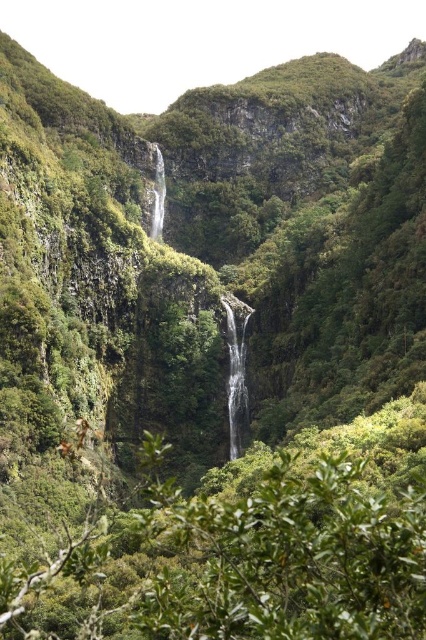
Question: Can you confirm if white smooth waterfall at center is thinner than transparent glass waterfall at center?

Choices:
 (A) no
 (B) yes

Answer: (A)

Question: Among these points, which one is nearest to the camera?

Choices:
 (A) pyautogui.click(x=158, y=237)
 (B) pyautogui.click(x=236, y=346)

Answer: (B)

Question: Can you confirm if white smooth waterfall at center is positioned below transparent glass waterfall at center?

Choices:
 (A) yes
 (B) no

Answer: (A)

Question: Which object appears closest to the camera in this image?

Choices:
 (A) transparent glass waterfall at center
 (B) white smooth waterfall at center

Answer: (B)

Question: Can you confirm if white smooth waterfall at center is thinner than transparent glass waterfall at center?

Choices:
 (A) no
 (B) yes

Answer: (A)

Question: Which object appears farthest from the camera in this image?

Choices:
 (A) white smooth waterfall at center
 (B) transparent glass waterfall at center

Answer: (B)